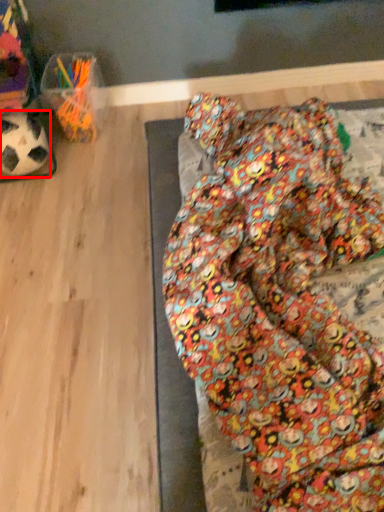
Question: Considering the relative positions of football (annotated by the red box) and bean bag chair in the image provided, where is football (annotated by the red box) located with respect to the staircase?

Choices:
 (A) left
 (B) right

Answer: (A)